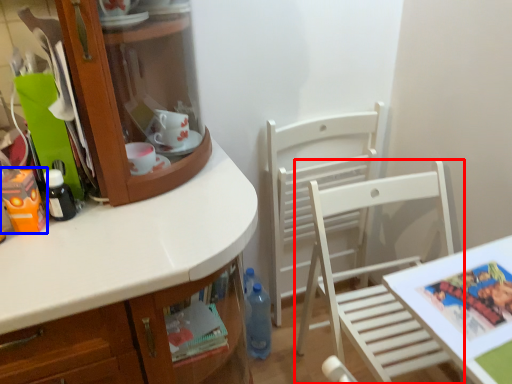
Question: Which object is closer to the camera taking this photo, chair (highlighted by a red box) or toy (highlighted by a blue box)?

Choices:
 (A) chair
 (B) toy

Answer: (A)